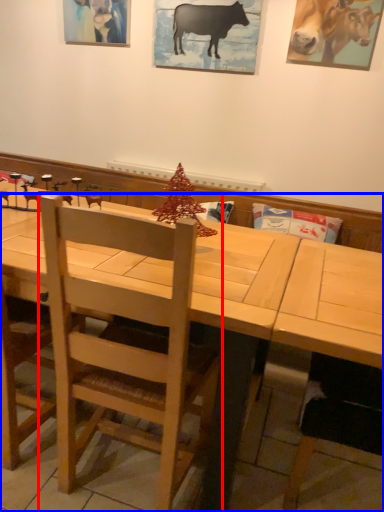
Question: Which of the following is the closest to the observer, chair (highlighted by a red box) or table (highlighted by a blue box)?

Choices:
 (A) chair
 (B) table

Answer: (B)